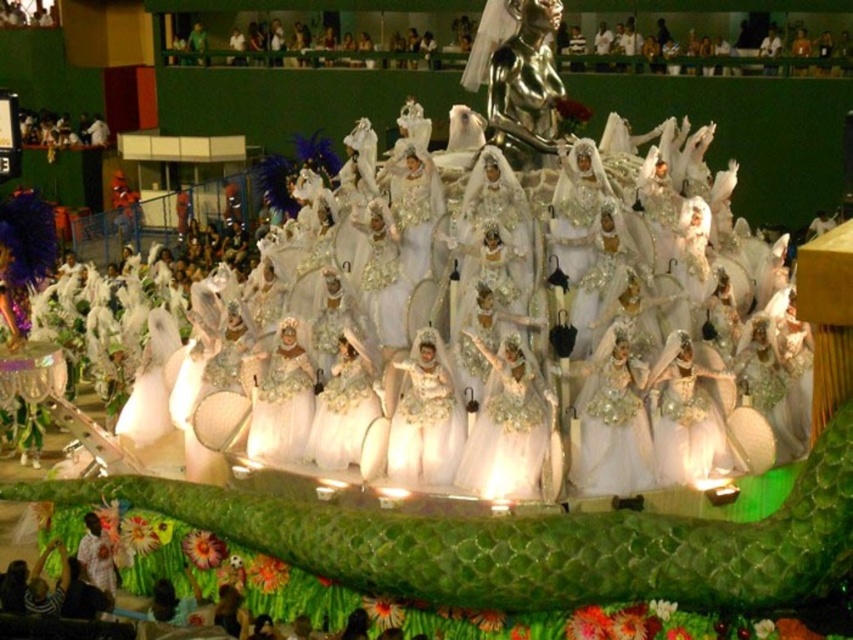
You are a photographer at the carnival, and you want to capture the white tulle dress at center in your shot. According to the coordinates provided, where should you focus your camera?

The white tulle dress at center is located at point (511, 429), so you should focus your camera there.

You are a photographer at the carnival and want to capture a photo of both the white tulle dress at center and the ivory satin dress at center. Which dress should you focus on first if you want to ensure both are in the frame without moving the camera?

The white tulle dress at center is located below the ivory satin dress at center. To capture both in the frame without moving the camera, focus on the ivory satin dress at center first, as it is higher up, allowing the white tulle dress at center to naturally fall into the lower part of the frame.